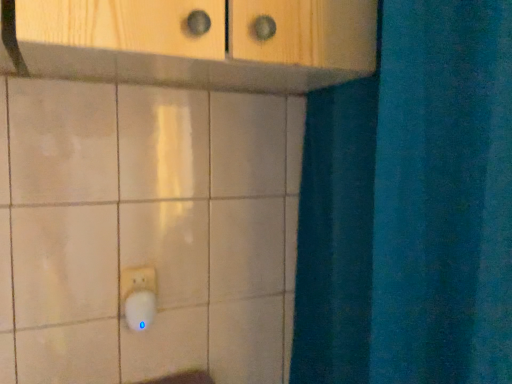
Question: Relative to white plastic knob at lower left, is white plastic light switch at lower left in front or behind?

Choices:
 (A) front
 (B) behind

Answer: (B)

Question: From a real-world perspective, is white plastic light switch at lower left physically located above or below white plastic knob at lower left?

Choices:
 (A) below
 (B) above

Answer: (B)

Question: Is white plastic light switch at lower left bigger or smaller than white plastic knob at lower left?

Choices:
 (A) big
 (B) small

Answer: (B)

Question: Based on their sizes in the image, would you say white plastic knob at lower left is bigger or smaller than white plastic light switch at lower left?

Choices:
 (A) small
 (B) big

Answer: (B)

Question: Is white plastic knob at lower left to the left or to the right of white plastic light switch at lower left in the image?

Choices:
 (A) left
 (B) right

Answer: (B)

Question: Considering the positions of point (139, 316) and point (125, 296), is point (139, 316) closer or farther from the camera than point (125, 296)?

Choices:
 (A) closer
 (B) farther

Answer: (A)

Question: Looking at their shapes, would you say white plastic knob at lower left is wider or thinner than white plastic light switch at lower left?

Choices:
 (A) wide
 (B) thin

Answer: (A)